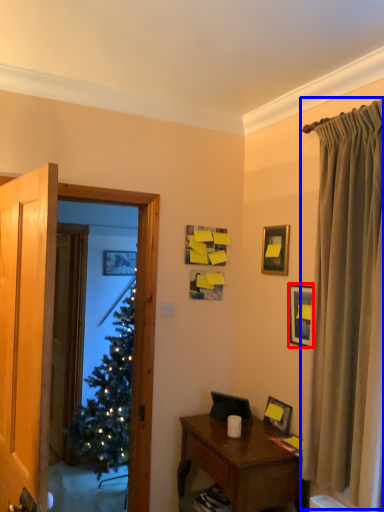
Question: Which object is further to the camera taking this photo, picture frame (highlighted by a red box) or curtain (highlighted by a blue box)?

Choices:
 (A) picture frame
 (B) curtain

Answer: (A)